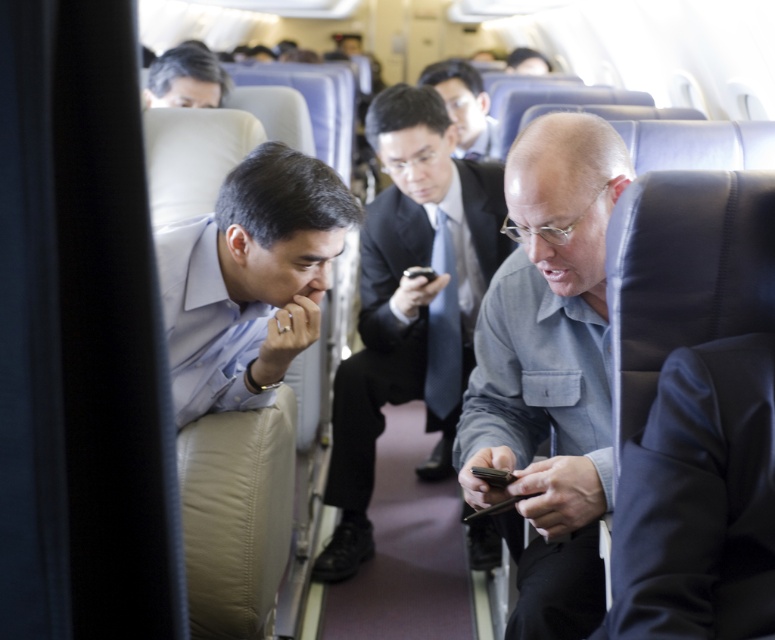
Who is shorter, gray fabric shirt at center or matte black suit at center?

gray fabric shirt at center

Which is more to the left, gray fabric shirt at center or matte black suit at center?

matte black suit at center is more to the left.

The image size is (775, 640). Find the location of `gray fabric shirt at center`. gray fabric shirt at center is located at coordinates (548, 371).

Locate an element on the screen. The height and width of the screenshot is (640, 775). gray fabric shirt at center is located at coordinates (548, 371).

Who is more distant from viewer, (525, 227) or (469, 116)?

Point (469, 116)

Between point (467, 406) and point (481, 122), which one is positioned in front?

Point (467, 406)

Describe the element at coordinates (548, 371) in the screenshot. This screenshot has width=775, height=640. I see `gray fabric shirt at center` at that location.

At what (x,y) coordinates should I click in order to perform the action: click on gray fabric shirt at center. Please return your answer as a coordinate pair (x, y). Looking at the image, I should click on (548, 371).

Can you confirm if smooth black suit at center is bigger than gray hair at upper center?

Yes.

What do you see at coordinates (463, 106) in the screenshot? This screenshot has height=640, width=775. I see `smooth black suit at center` at bounding box center [463, 106].

Does point (453, 104) come behind point (155, 104)?

Yes.

Identify the location of smooth black suit at center. Image resolution: width=775 pixels, height=640 pixels. (463, 106).